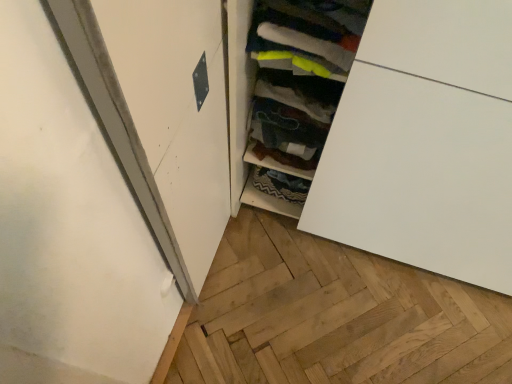
What do you see at coordinates (286, 87) in the screenshot?
I see `textured fabric drawer at center` at bounding box center [286, 87].

Where is `textured fabric drawer at center`? The image size is (512, 384). textured fabric drawer at center is located at coordinates (286, 87).

What is the approximate height of textured fabric drawer at center?

12.41 inches.

Image resolution: width=512 pixels, height=384 pixels. Identify the location of textured fabric drawer at center. (286, 87).